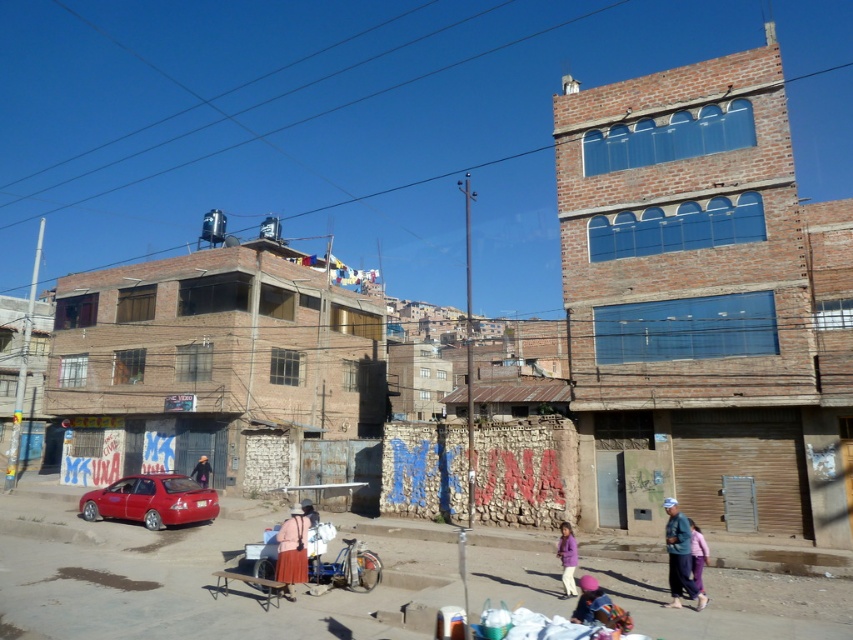
Based on the photo, can you confirm if blue denim jacket at lower right is wider than purple fabric pants at lower right?

Indeed, blue denim jacket at lower right has a greater width compared to purple fabric pants at lower right.

Does blue denim jacket at lower right appear on the right side of purple fabric pants at lower right?

Incorrect, blue denim jacket at lower right is not on the right side of purple fabric pants at lower right.

At what (x,y) coordinates should I click in order to perform the action: click on blue denim jacket at lower right. Please return your answer as a coordinate pair (x, y). The width and height of the screenshot is (853, 640). Looking at the image, I should click on (679, 557).

In the scene shown: Does blue fabric child at lower center have a larger size compared to purple fabric pants at lower right?

No, blue fabric child at lower center is not bigger than purple fabric pants at lower right.

Is blue fabric child at lower center wider than purple fabric pants at lower right?

Yes, blue fabric child at lower center is wider than purple fabric pants at lower right.

Describe the element at coordinates (589, 600) in the screenshot. I see `blue fabric child at lower center` at that location.

I want to click on blue fabric child at lower center, so click(x=589, y=600).

Who is more forward, (401, 630) or (566, 564)?

Point (401, 630) is in front.

Is point (108, 582) positioned in front of point (572, 531)?

No, (108, 582) is further to viewer.

Does point (660, 589) lie behind point (564, 528)?

Yes.

The image size is (853, 640). Identify the location of metallic red car at lower left. (193, 577).